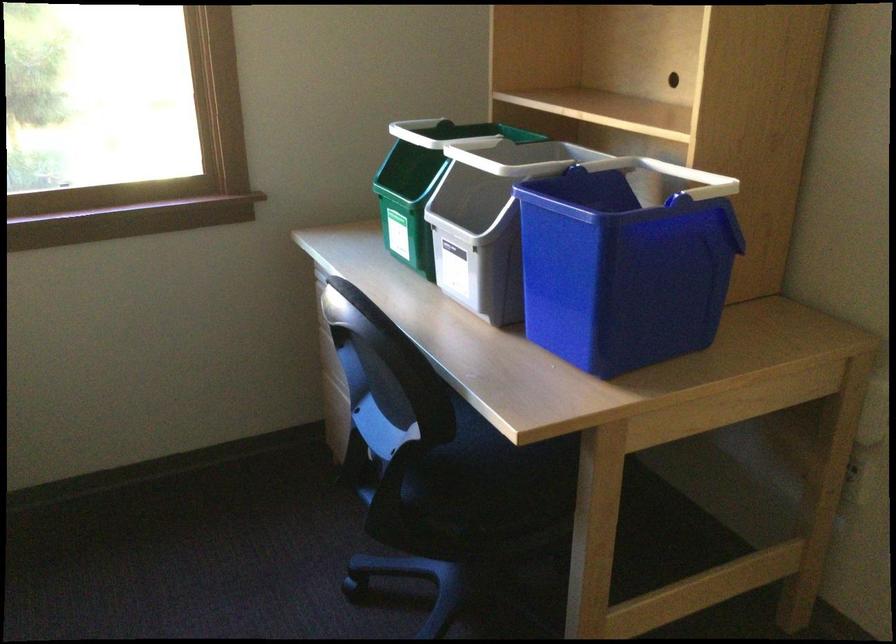
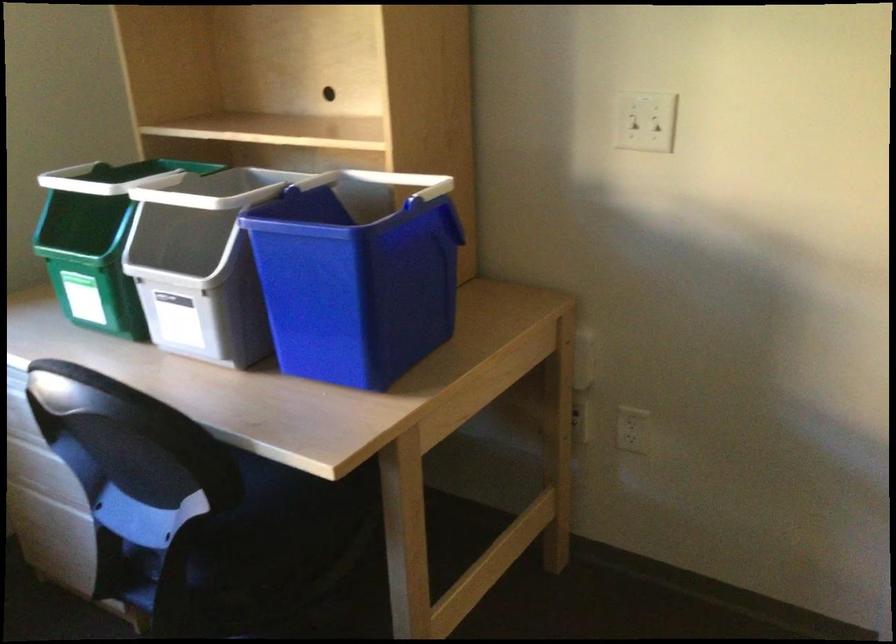
Question: How did the camera likely rotate?

Choices:
 (A) Left
 (B) Right
 (C) Up
 (D) Down

Answer: (B)